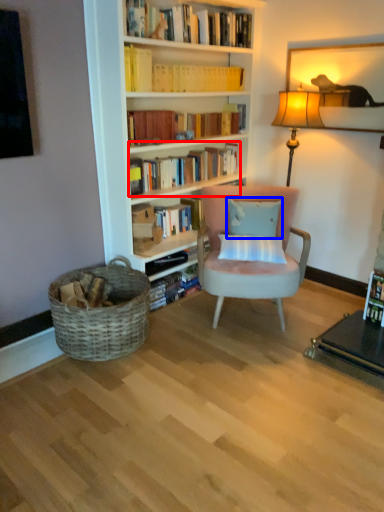
Question: Which point is further to the camera, book (highlighted by a red box) or pillow (highlighted by a blue box)?

Choices:
 (A) book
 (B) pillow

Answer: (A)